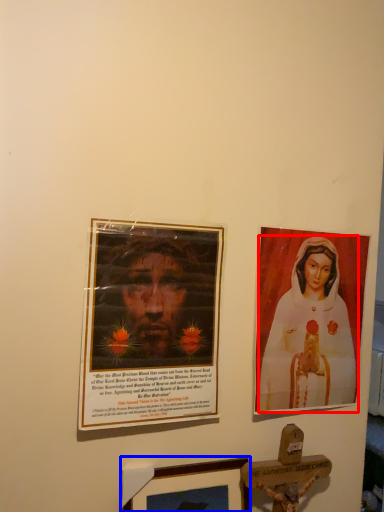
Question: Among these objects, which one is farthest to the camera, woman (highlighted by a red box) or picture frame (highlighted by a blue box)?

Choices:
 (A) woman
 (B) picture frame

Answer: (A)